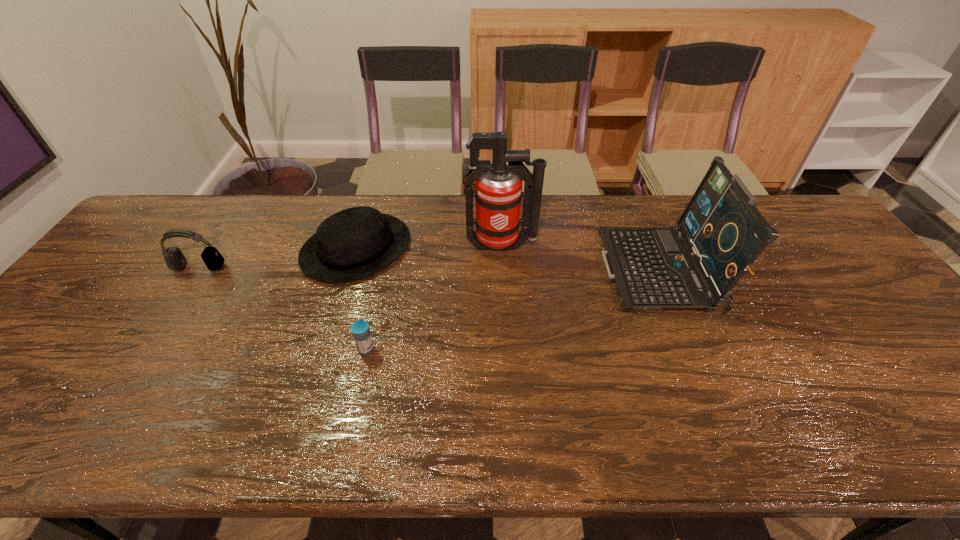
What are the coordinates of `free location at the near edge` in the screenshot? It's located at (515, 425).

Locate an element on the screen. This screenshot has height=540, width=960. free region at the left edge is located at coordinates (85, 348).

In the image, there is a desktop. Identify the location of free space at the right edge. (857, 286).

Locate an element on the screen. free location at the far left corner is located at coordinates (153, 237).

Locate an element on the screen. Image resolution: width=960 pixels, height=540 pixels. free space at the far right corner is located at coordinates (798, 228).

Locate an element on the screen. vacant area between the medicine and the rightmost object is located at coordinates (513, 310).

Where is `free space that is in between the medicine and the fire extinguisher`? This screenshot has width=960, height=540. free space that is in between the medicine and the fire extinguisher is located at coordinates (434, 298).

Where is `free space between the second tallest object and the second shortest object`? This screenshot has height=540, width=960. free space between the second tallest object and the second shortest object is located at coordinates point(508,260).

Find the location of `free area in between the shortest object and the fourth tallest object`. free area in between the shortest object and the fourth tallest object is located at coordinates pyautogui.click(x=361, y=299).

I want to click on free space between the medicine and the fourth object from left to right, so click(434, 298).